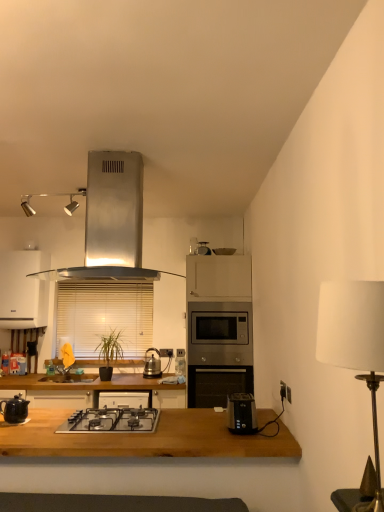
Find the location of `vacant region to the left of black plastic toaster at lower center`. vacant region to the left of black plastic toaster at lower center is located at coordinates (215, 431).